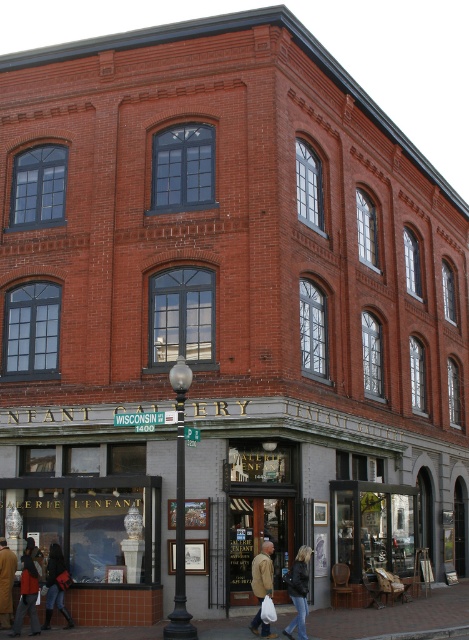
Is point (176, 522) positioned before point (258, 598)?

Yes, it is in front of point (258, 598).

Which is behind, point (179, 612) or point (257, 589)?

Positioned behind is point (257, 589).

Who is more forward, (180, 456) or (258, 595)?

Point (180, 456)

The height and width of the screenshot is (640, 469). Find the location of `black metal pole at center`. black metal pole at center is located at coordinates (180, 540).

Is black leather jacket at lower center further to camera compared to brown leather jacket at lower left?

No.

Can you confirm if black leather jacket at lower center is positioned below brown leather jacket at lower left?

Actually, black leather jacket at lower center is above brown leather jacket at lower left.

Identify the location of black leather jacket at lower center. Image resolution: width=469 pixels, height=640 pixels. (299, 592).

Which is in front, point (325, 612) or point (297, 604)?

Point (297, 604) is more forward.

Identify the location of brick pavement at lower center. (398, 618).